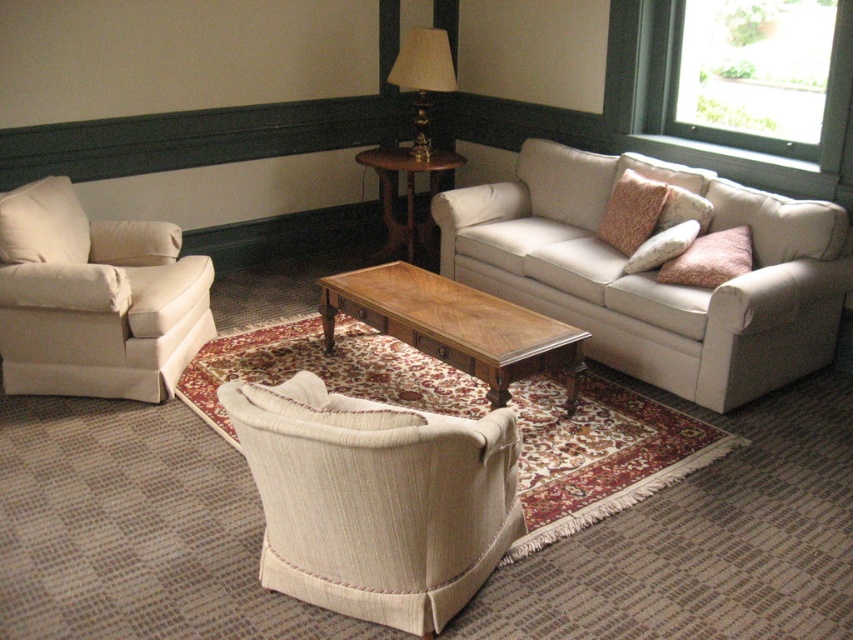
You are arranging flowers in the living room and need to place them between the mahogany wood side table at center and the gold metallic lamp at upper center. Which side should you place the flowers to ensure they are closer to the side table?

The mahogany wood side table at center is to the left of the gold metallic lamp at upper center, so placing the flowers to the left of the lamp would position them closer to the side table.

You are sitting in the living room and want to turn on the gold metallic lamp at upper center. However, the mahogany wood side table at center is blocking your view. Can you reach the lamp without moving the table?

The gold metallic lamp at upper center is behind the mahogany wood side table at center. Since the table is blocking the view, you would need to move it to access the lamp.

You are a guest in this living room and want to place your drink on a surface. Which object would be more stable for placing a tall glass? The mahogany wood side table at center or the gold metallic lamp at upper center?

The mahogany wood side table at center has a greater height compared to the gold metallic lamp at upper center, making it more stable for placing a tall glass.